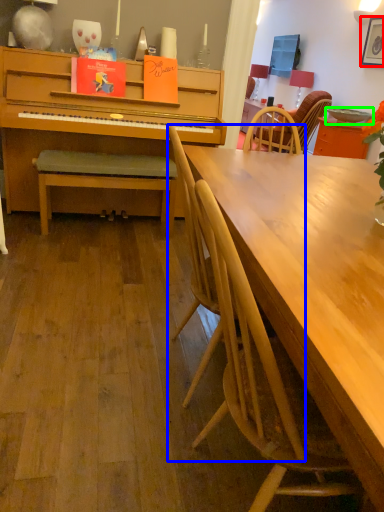
Question: Based on their relative distances, which object is farther from picture frame (highlighted by a red box)? Choose from chair (highlighted by a blue box) and bowl (highlighted by a green box).

Choices:
 (A) chair
 (B) bowl

Answer: (A)